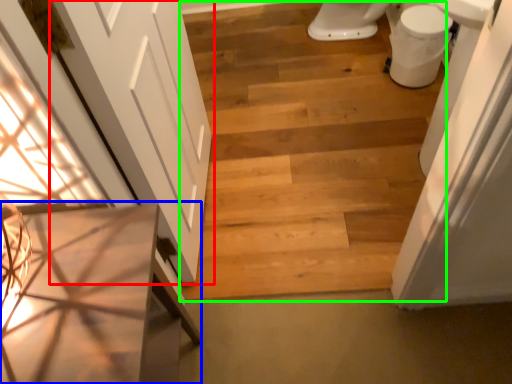
Question: Estimate the real-world distances between objects in this image. Which object is farther from door (highlighted by a red box), vanity (highlighted by a blue box) or stairwell (highlighted by a green box)?

Choices:
 (A) vanity
 (B) stairwell

Answer: (B)